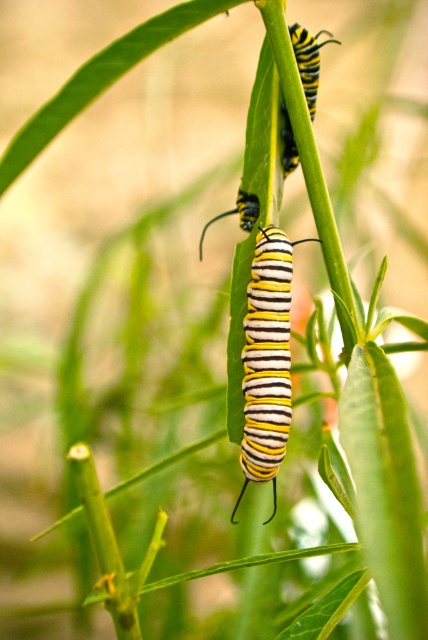
Is yellow striped caterpillar at center further to the viewer compared to yellow striped caterpillar at upper center?

No, yellow striped caterpillar at center is in front of yellow striped caterpillar at upper center.

Describe the element at coordinates (267, 360) in the screenshot. I see `yellow striped caterpillar at center` at that location.

This screenshot has width=428, height=640. Identify the location of yellow striped caterpillar at center. (267, 360).